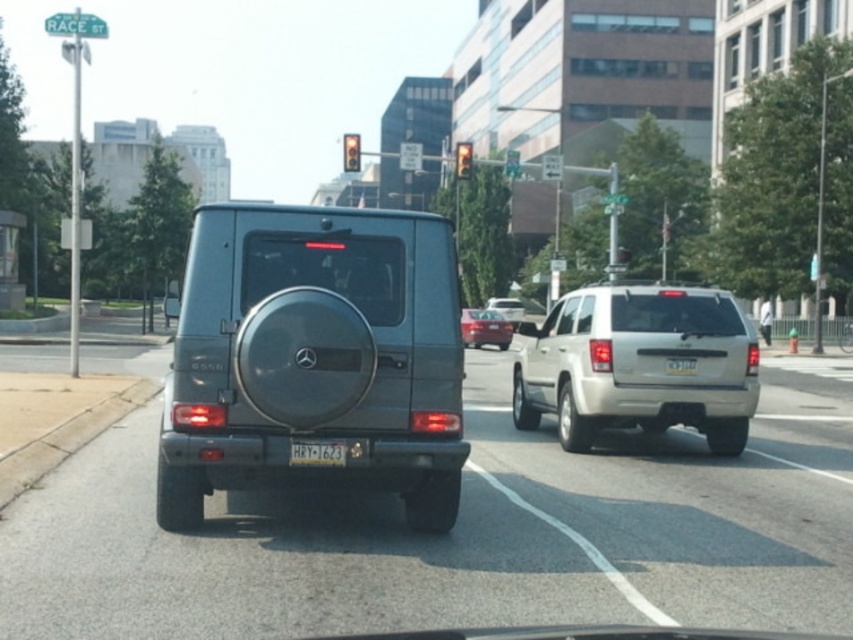
Question: Which point is farther to the camera?

Choices:
 (A) matte red sedan at center
 (B) red glass traffic light at center

Answer: (B)

Question: Is matte silver suv at center smaller than red glass traffic light at center?

Choices:
 (A) yes
 (B) no

Answer: (A)

Question: Is silver metallic suv at center wider than red glass traffic light at center?

Choices:
 (A) no
 (B) yes

Answer: (A)

Question: Among these objects, which one is farthest from the camera?

Choices:
 (A) yellow matte license plate at center
 (B) matte red sedan at center
 (C) amber glass traffic light at center
 (D) matte gray suv at center

Answer: (C)

Question: Which of these objects is positioned closest to the matte silver suv at center?

Choices:
 (A) amber glass traffic light at center
 (B) white plastic license plate at center

Answer: (A)

Question: Does silver metallic suv at center appear on the left side of matte silver suv at center?

Choices:
 (A) yes
 (B) no

Answer: (A)